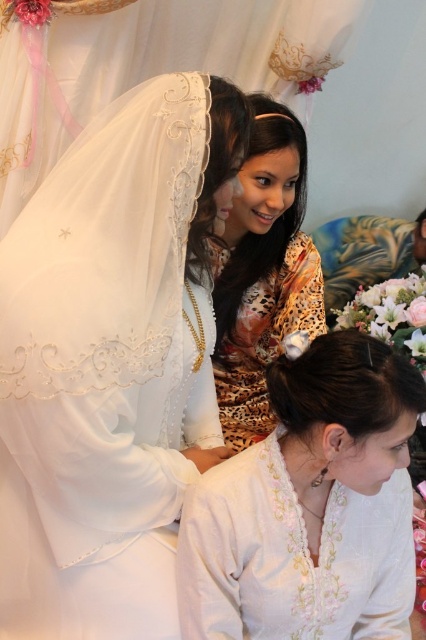
Does white lace veil at upper left appear over leopard print dress at center?

No, white lace veil at upper left is not above leopard print dress at center.

Describe the element at coordinates (112, 362) in the screenshot. I see `white lace veil at upper left` at that location.

The height and width of the screenshot is (640, 426). Find the location of `white lace veil at upper left`. white lace veil at upper left is located at coordinates (112, 362).

Where is `white lace veil at upper left`? white lace veil at upper left is located at coordinates (112, 362).

Which is more to the left, white floral blouse at lower center or leopard print dress at center?

leopard print dress at center

Which is below, white floral blouse at lower center or leopard print dress at center?

white floral blouse at lower center

Between point (328, 403) and point (245, 193), which one is positioned in front?

Point (328, 403)

Where is `white floral blouse at lower center`? The height and width of the screenshot is (640, 426). white floral blouse at lower center is located at coordinates (310, 506).

Is point (141, 598) in front of point (376, 358)?

That is False.

Between point (138, 400) and point (236, 467), which one is positioned in front?

Positioned in front is point (236, 467).

The width and height of the screenshot is (426, 640). Identify the location of white lace veil at upper left. 112,362.